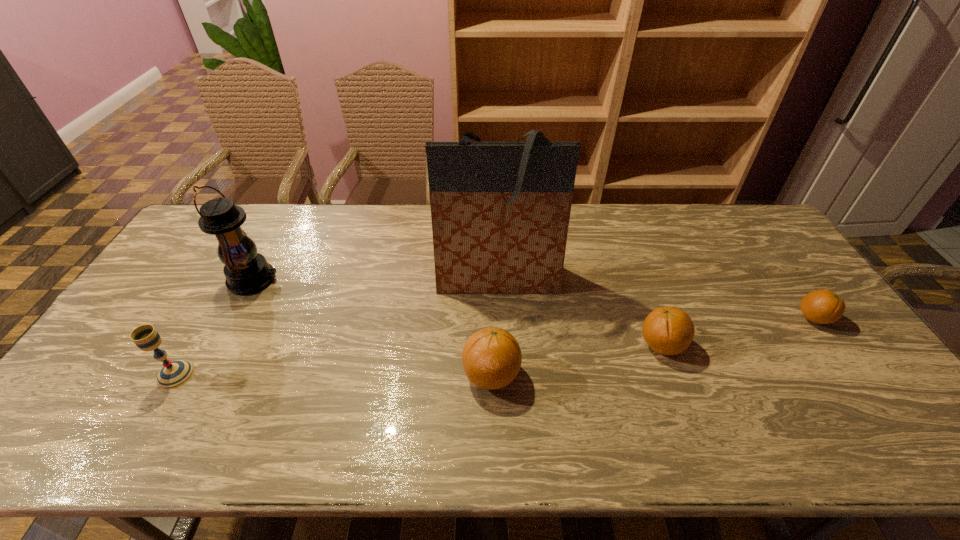
Please point a spot on the left to add another orange. Please provide its 2D coordinates. Your answer should be formatted as a tuple, i.e. [(x, y)], where the tuple contains the x and y coordinates of a point satisfying the conditions above.

[(299, 408)]